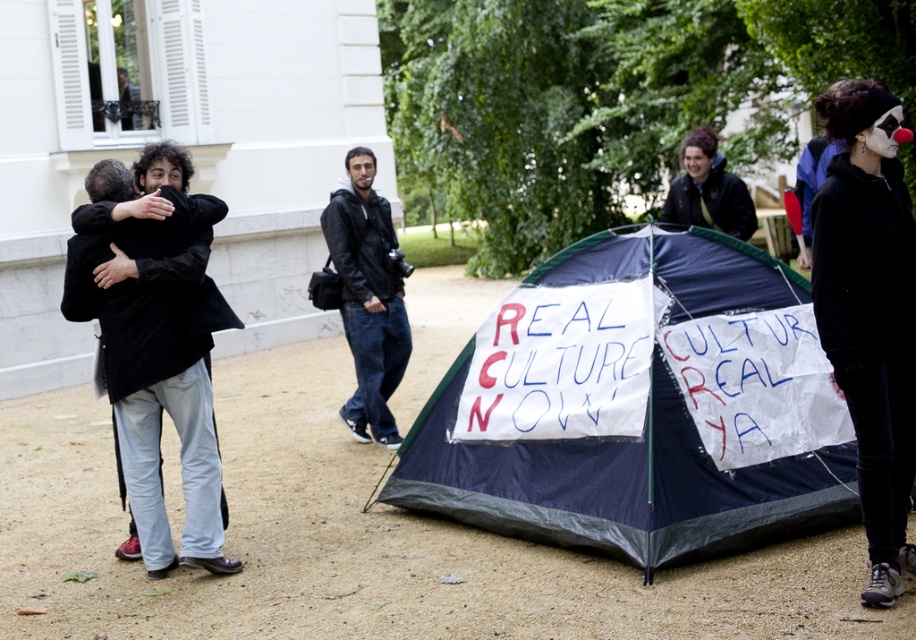
Does dark blue tarpaulin tent at center have a larger size compared to matte black jacket at upper center?

Yes.

Which is above, dark blue tarpaulin tent at center or matte black jacket at upper center?

matte black jacket at upper center is above.

Where is `dark blue tarpaulin tent at center`? dark blue tarpaulin tent at center is located at coordinates (638, 404).

Measure the distance between dark blue tarpaulin tent at center and camera.

dark blue tarpaulin tent at center and camera are 18.33 feet apart.

Is point (642, 314) positioned after point (129, 364)?

Yes, point (642, 314) is farther from viewer.

Between point (685, 330) and point (202, 449), which one is positioned behind?

The point (685, 330) is behind.

I want to click on dark blue tarpaulin tent at center, so click(638, 404).

Who is positioned more to the left, black coat at left or black leather jacket at center?

Positioned to the left is black coat at left.

Does black coat at left appear under black leather jacket at center?

Yes.

You are a GUI agent. You are given a task and a screenshot of the screen. Output one action in this format:
    pyautogui.click(x=<x>, y=<y>)
    Task: Click on the black coat at left
    This screenshot has height=640, width=916.
    Given the screenshot: What is the action you would take?
    pyautogui.click(x=155, y=348)